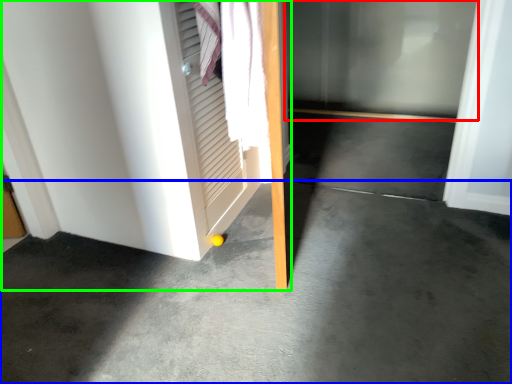
Question: Based on their relative distances, which object is nearer to glass door (highlighted by a red box)? Choose from concrete (highlighted by a blue box) and door (highlighted by a green box).

Choices:
 (A) concrete
 (B) door

Answer: (B)